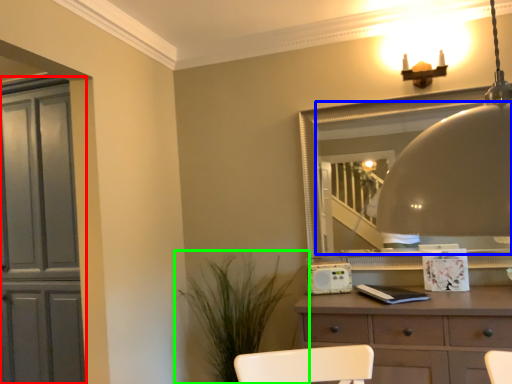
Question: Considering the real-world distances, which object is farthest from cabinetry (highlighted by a red box)? mirror (highlighted by a blue box) or houseplant (highlighted by a green box)?

Choices:
 (A) mirror
 (B) houseplant

Answer: (A)